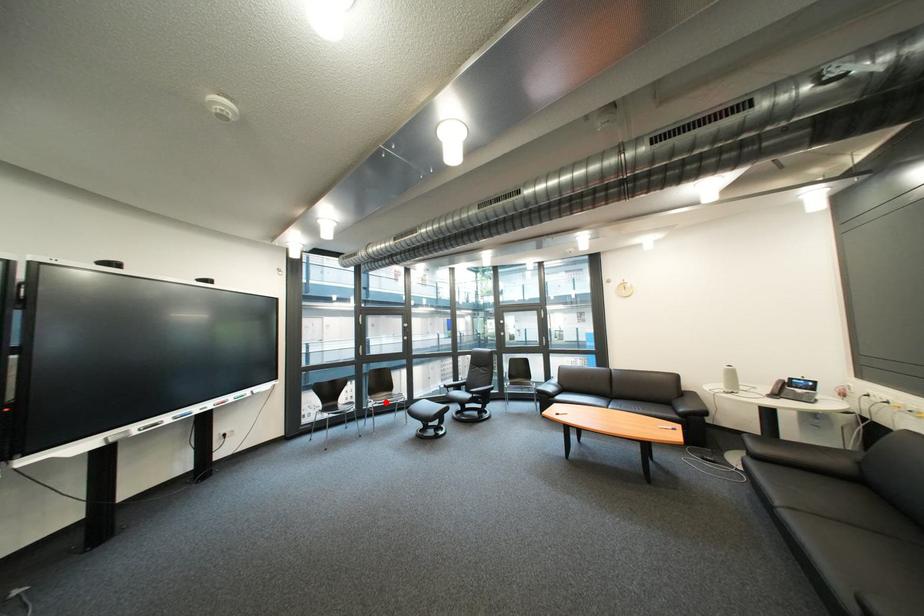
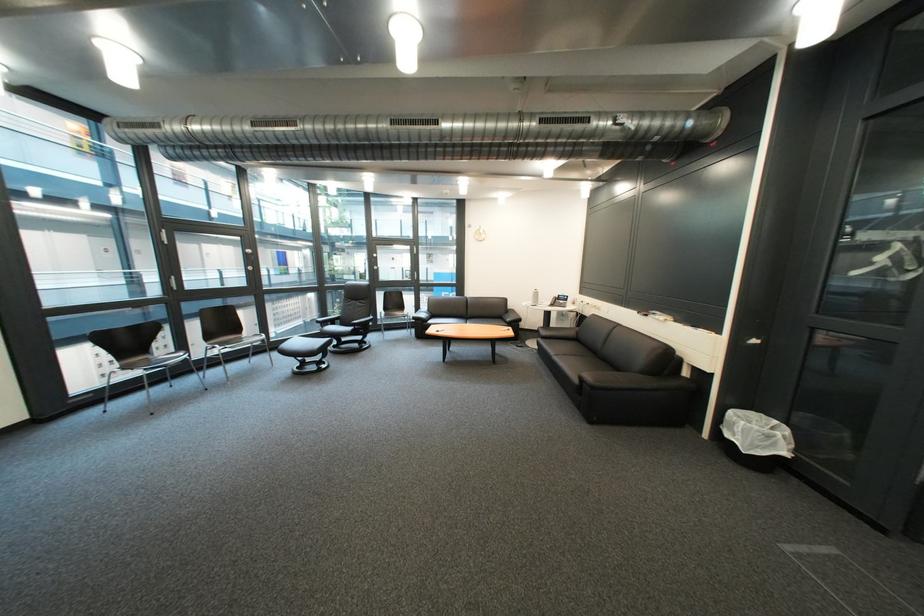
Question: I am providing you with two images of the same scene from different viewpoints. A red point is shown in image1. For the corresponding object point in image2, is it positioned nearer or farther from the camera?

Choices:
 (A) Nearer
 (B) Farther

Answer: (A)